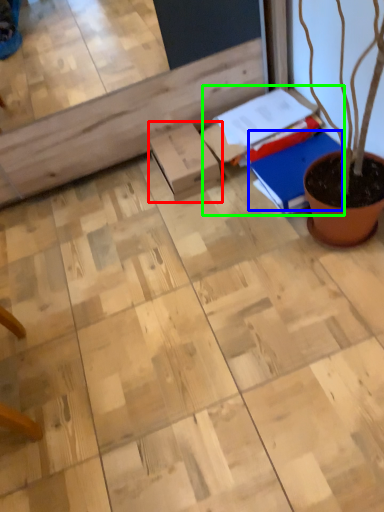
Question: Based on their relative distances, which object is nearer to cardboard box (highlighted by a red box)? Choose from notebook (highlighted by a blue box) and book (highlighted by a green box).

Choices:
 (A) notebook
 (B) book

Answer: (B)